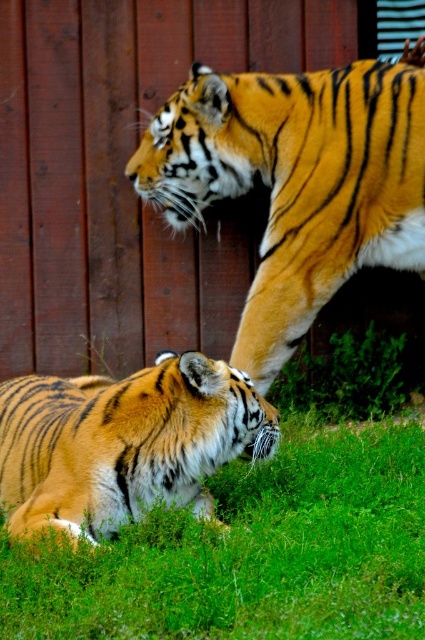
Question: Can you confirm if green grass at lower center is thinner than orange fur tiger at lower left?

Choices:
 (A) yes
 (B) no

Answer: (B)

Question: Is orange-yellow fur tiger at upper center smaller than orange fur tiger at lower left?

Choices:
 (A) yes
 (B) no

Answer: (B)

Question: Estimate the real-world distances between objects in this image. Which object is closer to the orange-yellow fur tiger at upper center?

Choices:
 (A) orange fur tiger at lower left
 (B) green grass at lower center

Answer: (A)

Question: Which of the following is the farthest from the observer?

Choices:
 (A) (149, 419)
 (B) (319, 173)
 (C) (421, 600)

Answer: (B)

Question: Is green grass at lower center below orange fur tiger at lower left?

Choices:
 (A) yes
 (B) no

Answer: (A)

Question: Which point is farther to the camera?

Choices:
 (A) orange-yellow fur tiger at upper center
 (B) orange fur tiger at lower left
 (C) green grass at lower center

Answer: (A)